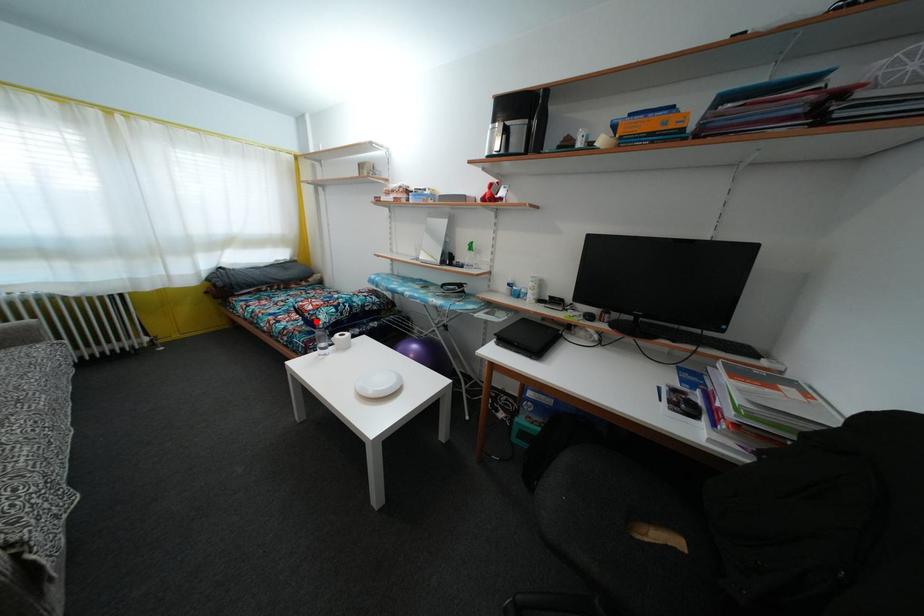
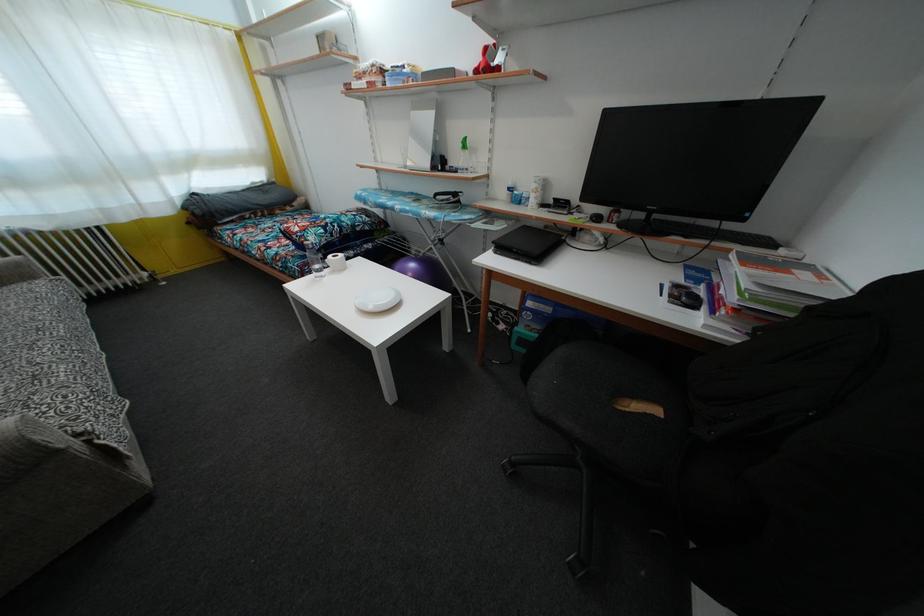
Where in the second image is the point corresponding to the highlighted location from the first image?

(305, 244)